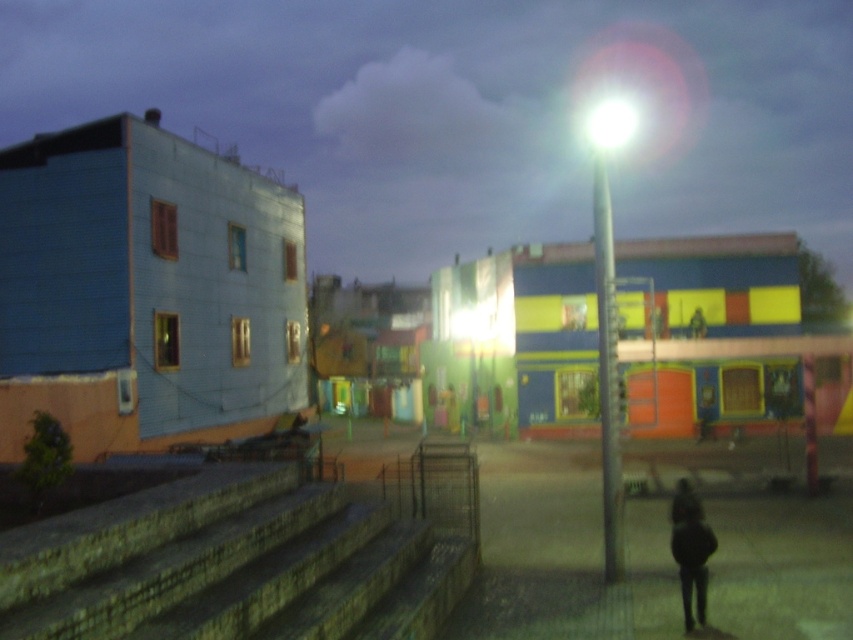
Between matte concrete steps at lower left and dark matte clothing at lower right, which one appears on the left side from the viewer's perspective?

Positioned to the left is matte concrete steps at lower left.

What do you see at coordinates (463, 112) in the screenshot?
I see `matte concrete steps at lower left` at bounding box center [463, 112].

At what (x,y) coordinates should I click in order to perform the action: click on matte concrete steps at lower left. Please return your answer as a coordinate pair (x, y). Image resolution: width=853 pixels, height=640 pixels. Looking at the image, I should click on (463, 112).

Measure the distance between point (614, 38) and camera.

The distance of point (614, 38) from camera is 798.99 feet.

Which of these two, matte concrete steps at lower left or silver metallic pole at center, stands taller?

With more height is matte concrete steps at lower left.

Locate an element on the screen. This screenshot has width=853, height=640. matte concrete steps at lower left is located at coordinates (463, 112).

What are the coordinates of `matte concrete steps at lower left` in the screenshot? It's located at (463, 112).

Who is positioned more to the right, silver metallic pole at center or dark matte clothing at lower right?

Positioned to the right is silver metallic pole at center.

Does silver metallic pole at center have a smaller size compared to dark matte clothing at lower right?

Incorrect, silver metallic pole at center is not smaller in size than dark matte clothing at lower right.

Between point (611, 445) and point (682, 556), which one is positioned behind?

Positioned behind is point (611, 445).

The width and height of the screenshot is (853, 640). I want to click on silver metallic pole at center, so click(607, 372).